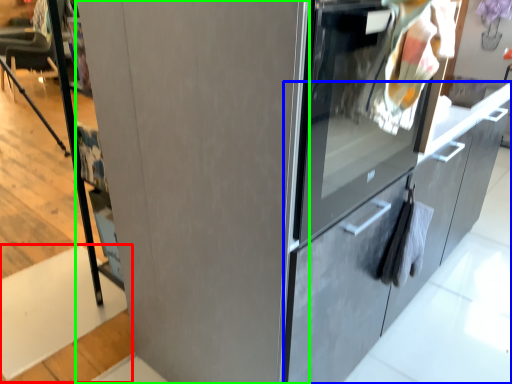
Question: Estimate the real-world distances between objects in this image. Which object is closer to stair (highlighted by a red box), cabinetry (highlighted by a blue box) or door (highlighted by a green box)?

Choices:
 (A) cabinetry
 (B) door

Answer: (B)